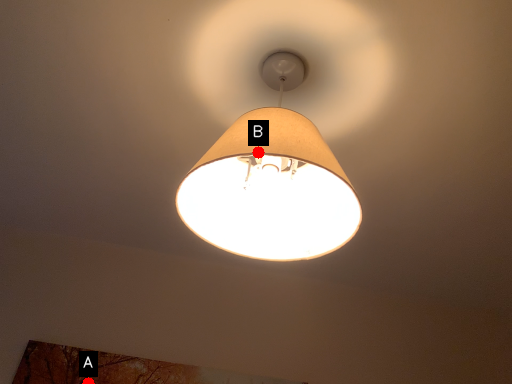
Question: Two points are circled on the image, labeled by A and B beside each circle. Which point is further to the camera?

Choices:
 (A) A is further
 (B) B is further

Answer: (A)